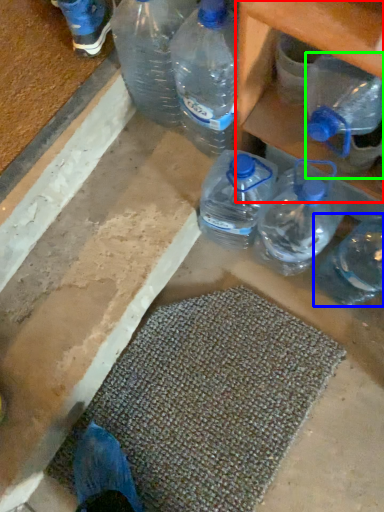
Question: Considering the real-world distances, which object is closest to shelf (highlighted by a red box)? bottle (highlighted by a blue box) or bottle (highlighted by a green box).

Choices:
 (A) bottle
 (B) bottle

Answer: (B)